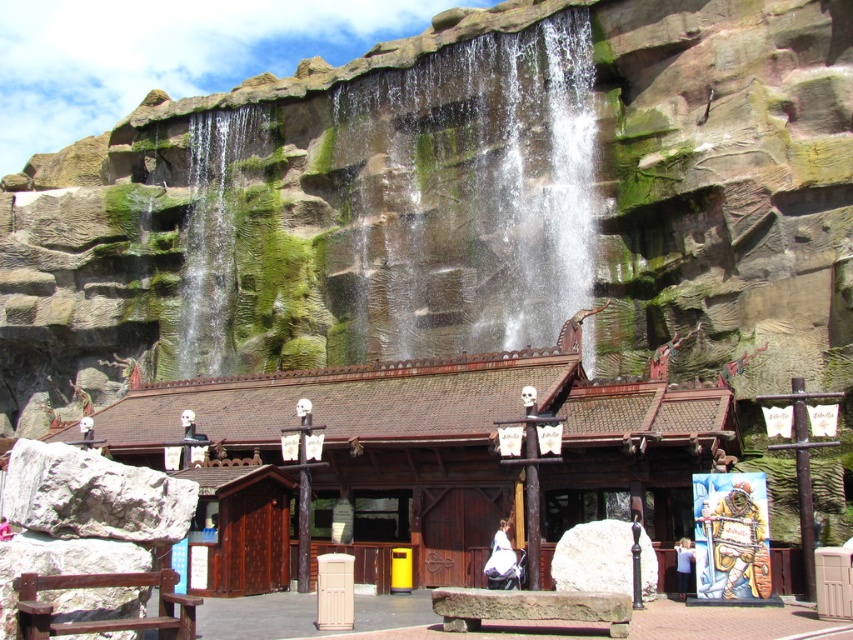
You are a park visitor who wants to take a photo of the white cotton dress at center from the green mossy rock at center. Considering the distance between them, do you think you can capture the dress clearly in your photo without moving closer?

The distance between the green mossy rock at center and the white cotton dress at center is 39.09 meters. At this distance, capturing the dress clearly without moving closer may be challenging unless you have a high zoom lens or a camera with excellent optical capabilities.

Looking at this image, you are standing in front of the waterfall and want to reach both points marked in the image. Which point, point (486,577) or point (686,557), is closer to you?

Point (486,577) is closer to the viewer than point (686,557).

You are a photographer planning to capture a photo of the white cotton dress at center and the white fabric shirt at center. Since both are placed at the center, you need to decide which one to focus on first based on their height. Which object should you focus on first?

The white cotton dress at center is shorter than the white fabric shirt at center, so you should focus on the white fabric shirt at center first as it is taller.